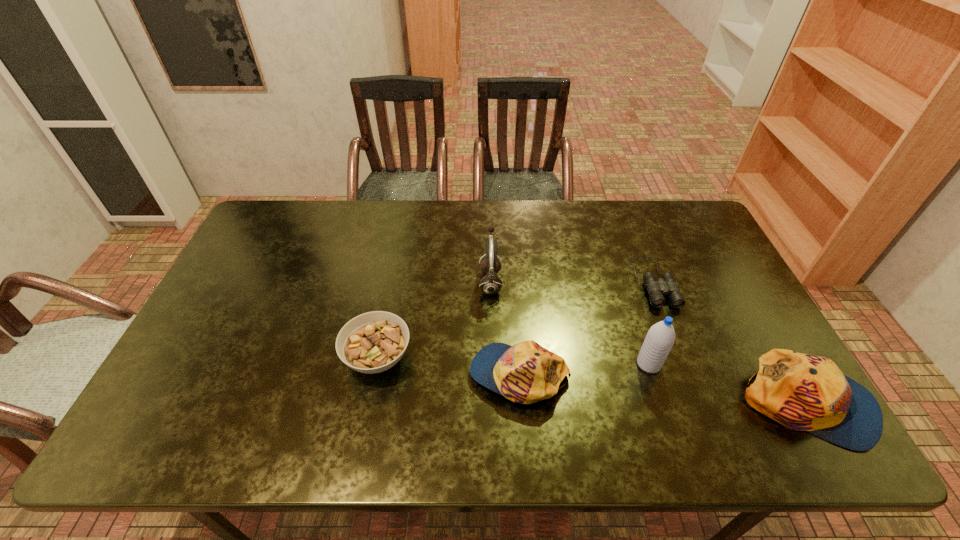
I want to click on vacant space that satisfies the following two spatial constraints: 1. at the eyepiece of the shortest object; 2. on the ear pads of the earphone, so click(654, 282).

The height and width of the screenshot is (540, 960). Identify the location of blank space that satisfies the following two spatial constraints: 1. on the ear pads of the earphone; 2. on the right side of the water bottle. (492, 364).